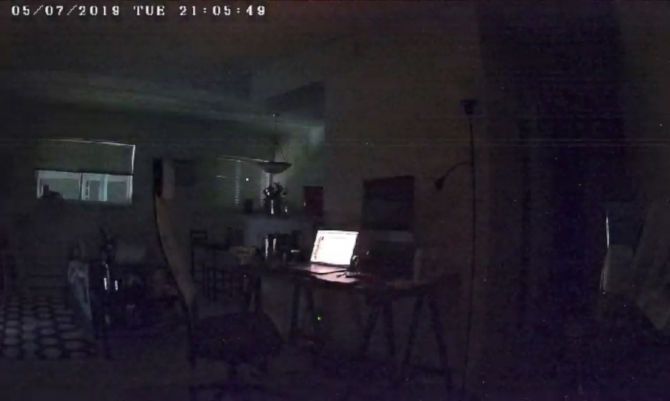
Identify the location of light. The height and width of the screenshot is (401, 670). (297, 118), (222, 102).